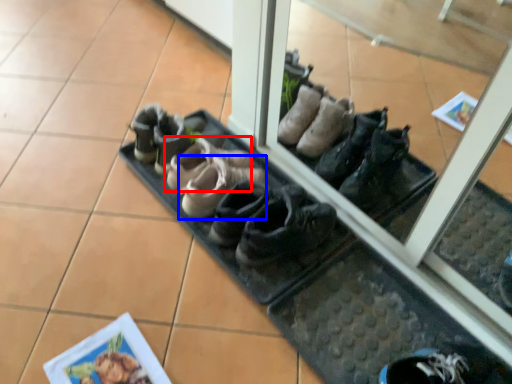
Question: Which of the following is the closest to the observer, footwear (highlighted by a red box) or footwear (highlighted by a blue box)?

Choices:
 (A) footwear
 (B) footwear

Answer: (B)